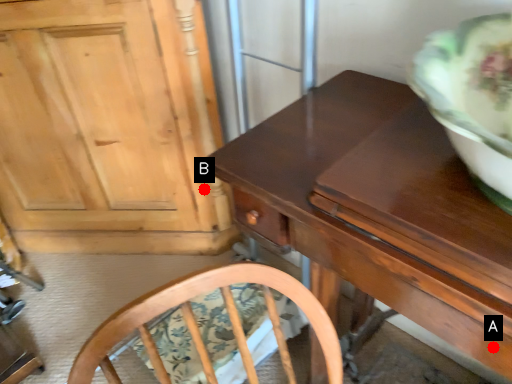
Question: Two points are circled on the image, labeled by A and B beside each circle. Which point is closer to the camera?

Choices:
 (A) A is closer
 (B) B is closer

Answer: (A)